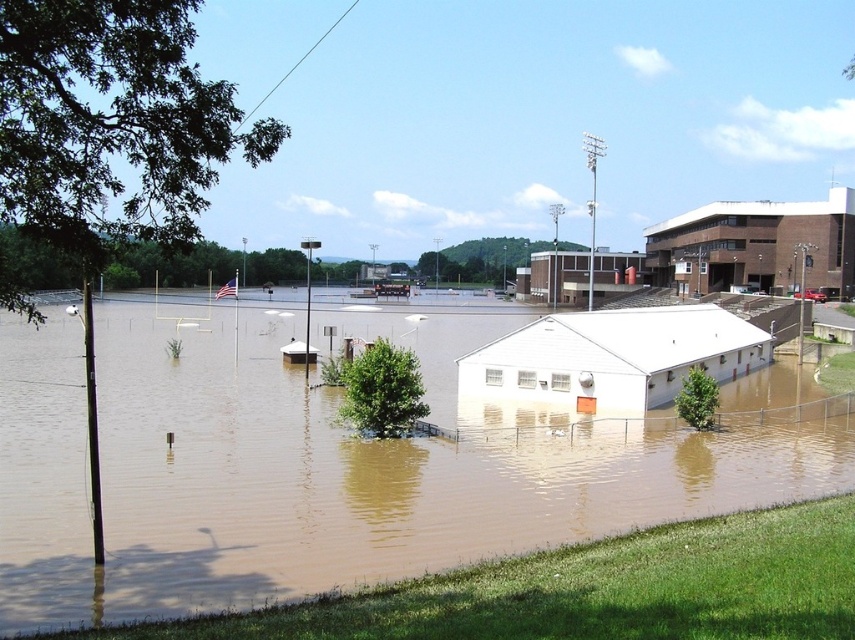
You are a delivery person trying to reach the white matte building at center. Based on the scene, is the brown muddy flood at center blocking your path to the building?

The brown muddy flood at center is below the white matte building at center, so it might not be blocking the path directly. However, the flood could still surround the building, making access difficult depending on the terrain around them.

You are standing at the point marked as point (329, 467) in the image. What type of terrain are you currently standing on?

You are standing on the brown muddy flood at center.

You are a delivery drone operator. Your drone has a maximum flight altitude of 10 meters. You need to fly over the brown muddy flood at center and the white matte building at center. Will your drone be able to safely pass over both objects without any issues?

The brown muddy flood at center has a greater height compared to white matte building at center. Since the drone can fly up to 10 meters, and the flood is taller than the building, the drone must ensure it can clear the flood. However, the exact heights aren